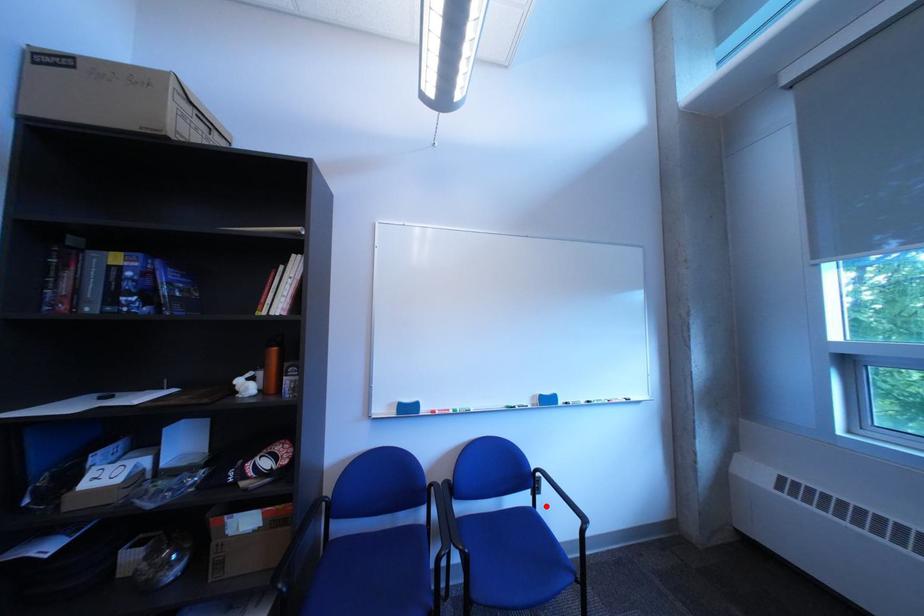
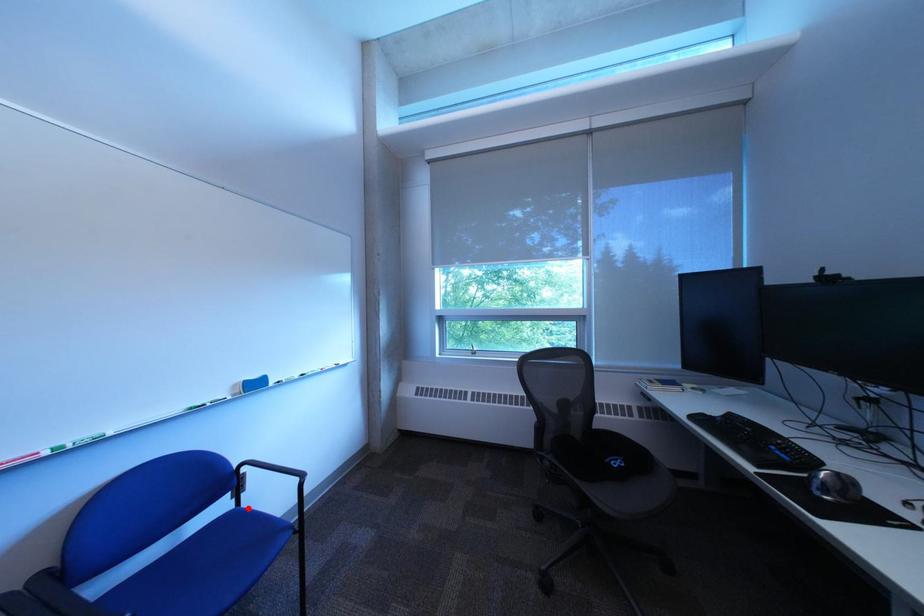
I am providing you with two images of the same scene from different viewpoints. A red point is marked on the first image and another point is marked on the second image. Does the point marked in image1 correspond to the same location as the one in image2?

Yes